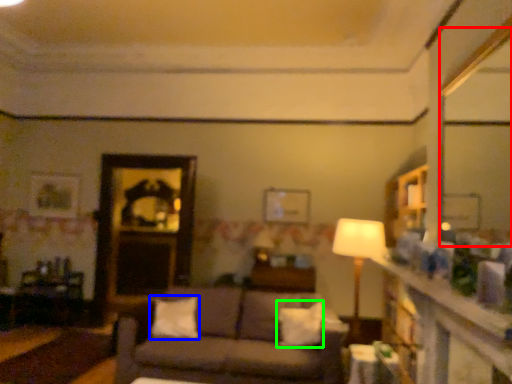
Question: Estimate the real-world distances between objects in this image. Which object is farther from mirror (highlighted by a red box), pillow (highlighted by a blue box) or pillow (highlighted by a green box)?

Choices:
 (A) pillow
 (B) pillow

Answer: (A)